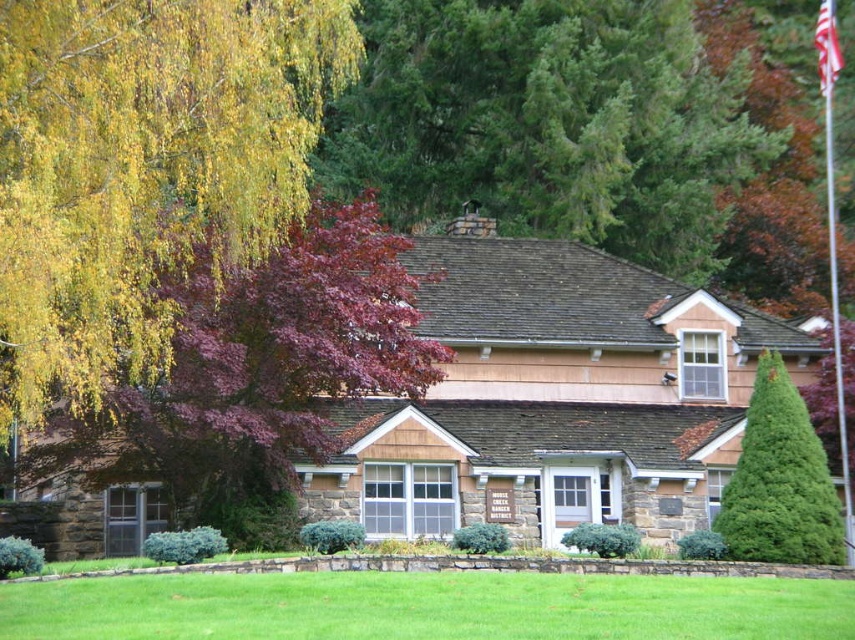
Question: Is silver metallic flag pole at upper right bigger than red fabric flag at upper right?

Choices:
 (A) yes
 (B) no

Answer: (A)

Question: Observing the image, what is the correct spatial positioning of green textured roof at upper center in reference to silver metallic flag pole at upper right?

Choices:
 (A) left
 (B) right

Answer: (A)

Question: Does green needle-like at upper right have a smaller size compared to red fabric flag at upper right?

Choices:
 (A) yes
 (B) no

Answer: (A)

Question: Which point is farther from the camera taking this photo?

Choices:
 (A) (305, 205)
 (B) (562, 173)
 (C) (827, 195)
 (D) (821, 61)

Answer: (C)

Question: Which point is farther to the camera?

Choices:
 (A) purple-leaved tree at left
 (B) red fabric flag at upper right
 (C) green needle-like at upper right

Answer: (B)

Question: Which point is farther to the camera?

Choices:
 (A) yellow leafy tree at upper left
 (B) silver metallic flag pole at upper right

Answer: (B)